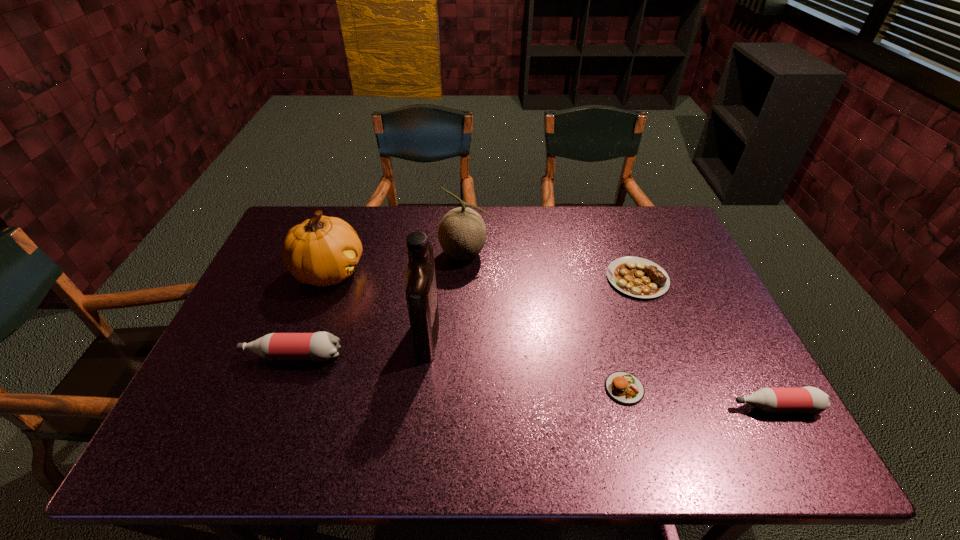
Find the location of a particular element. This screenshot has width=960, height=540. empty space between the tallest object and the pumpkin is located at coordinates (378, 302).

At what (x,y) coordinates should I click in order to perform the action: click on free space between the steak and the farther bottle. Please return your answer as a coordinate pair (x, y). The width and height of the screenshot is (960, 540). Looking at the image, I should click on (465, 317).

Point out which object is positioned as the third nearest to the patty. Please provide its 2D coordinates. Your answer should be formatted as a tuple, i.e. [(x, y)], where the tuple contains the x and y coordinates of a point satisfying the conditions above.

[(421, 292)]

Where is `the sixth closest object to the right bottle`? This screenshot has width=960, height=540. the sixth closest object to the right bottle is located at coordinates pyautogui.click(x=322, y=251).

Locate an element on the screen. Image resolution: width=960 pixels, height=540 pixels. blank area in the image that satisfies the following two spatial constraints: 1. on the back side of the patty; 2. on the label side of the liquor is located at coordinates (609, 333).

Where is `blank space that satisfies the following two spatial constraints: 1. on the front face of the patty; 2. on the left side of the pumpkin`? This screenshot has width=960, height=540. blank space that satisfies the following two spatial constraints: 1. on the front face of the patty; 2. on the left side of the pumpkin is located at coordinates (286, 388).

Where is `vacant region that satisfies the following two spatial constraints: 1. on the front side of the steak; 2. on the left side of the cantaloup`? The image size is (960, 540). vacant region that satisfies the following two spatial constraints: 1. on the front side of the steak; 2. on the left side of the cantaloup is located at coordinates (464, 279).